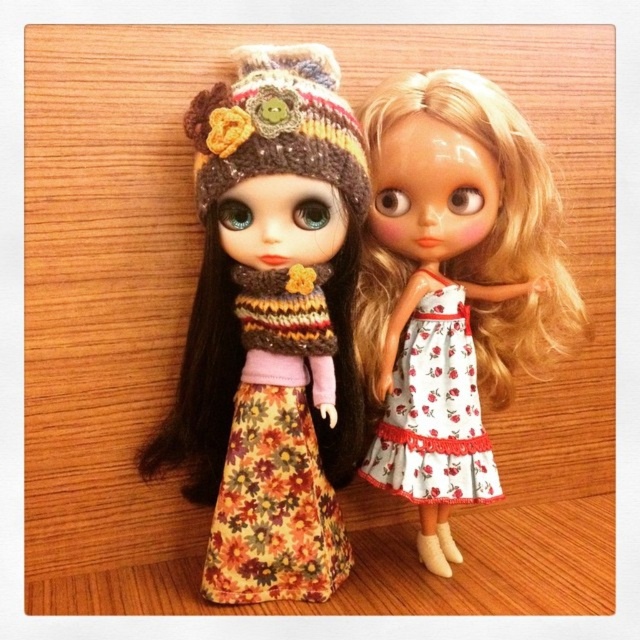
Does white floral dress at right have a lesser width compared to white floral fabric dress at right?

No.

You are a GUI agent. You are given a task and a screenshot of the screen. Output one action in this format:
    pyautogui.click(x=<x>, y=<y>)
    Task: Click on the white floral dress at right
    The width and height of the screenshot is (640, 640).
    Given the screenshot: What is the action you would take?
    pyautogui.click(x=451, y=285)

This screenshot has width=640, height=640. I want to click on white floral dress at right, so click(451, 285).

Is floral fabric dress at center smaller than white floral fabric dress at right?

No.

Where is `floral fabric dress at center`? This screenshot has height=640, width=640. floral fabric dress at center is located at coordinates (269, 326).

Find the location of a particular element. floral fabric dress at center is located at coordinates (269, 326).

The height and width of the screenshot is (640, 640). What are the coordinates of `floral fabric dress at center` in the screenshot? It's located at (269, 326).

Does floral fabric dress at center appear under white floral dress at right?

Actually, floral fabric dress at center is above white floral dress at right.

How much distance is there between floral fabric dress at center and white floral dress at right?

A distance of 7.42 inches exists between floral fabric dress at center and white floral dress at right.

Identify the location of floral fabric dress at center. This screenshot has height=640, width=640. (269, 326).